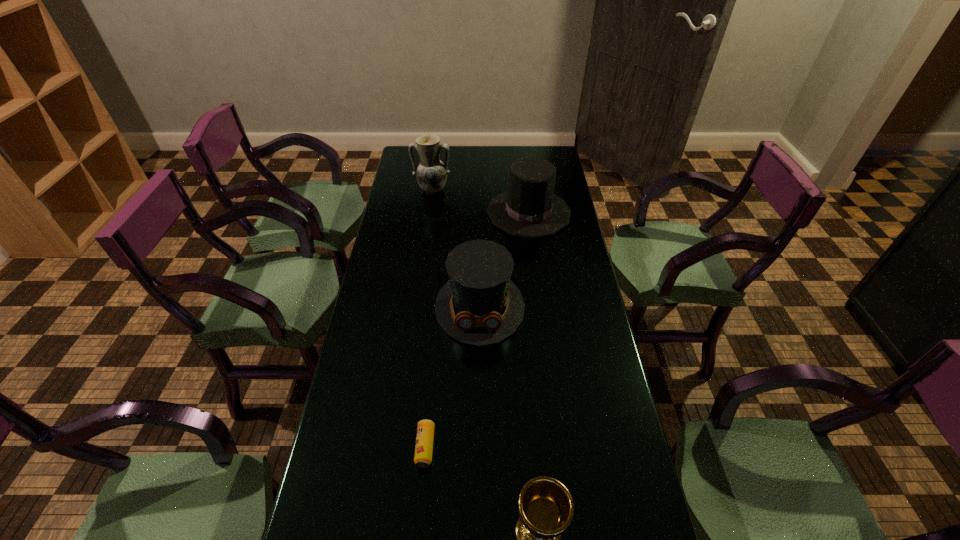
Locate an element on the screen. This screenshot has width=960, height=540. object located at the right edge is located at coordinates (529, 209).

Where is `vacant point at the far edge`? Image resolution: width=960 pixels, height=540 pixels. vacant point at the far edge is located at coordinates (455, 164).

Where is `vacant space at the left edge of the desktop`? vacant space at the left edge of the desktop is located at coordinates (394, 352).

Locate an element on the screen. vacant space at the right edge of the desktop is located at coordinates (551, 289).

Find the location of a particular element. This screenshot has width=960, height=540. free space between the pottery and the fourth farthest object is located at coordinates (429, 318).

Identify the location of free space between the pottery and the farther dress hat. (481, 201).

You are a GUI agent. You are given a task and a screenshot of the screen. Output one action in this format:
    pyautogui.click(x=<x>, y=<y>)
    Task: Click on the free point between the pottery and the second nearest object
    This screenshot has width=960, height=540.
    Given the screenshot: What is the action you would take?
    pyautogui.click(x=429, y=318)

Find the location of a particular element. The width and height of the screenshot is (960, 540). free space that is in between the farther dress hat and the pottery is located at coordinates 481,201.

Select which object appears as the second closest to the third nearest object. Please provide its 2D coordinates. Your answer should be formatted as a tuple, i.e. [(x, y)], where the tuple contains the x and y coordinates of a point satisfying the conditions above.

[(425, 430)]

Identify which object is the second closest to the nearest object. Please provide its 2D coordinates. Your answer should be formatted as a tuple, i.e. [(x, y)], where the tuple contains the x and y coordinates of a point satisfying the conditions above.

[(479, 305)]